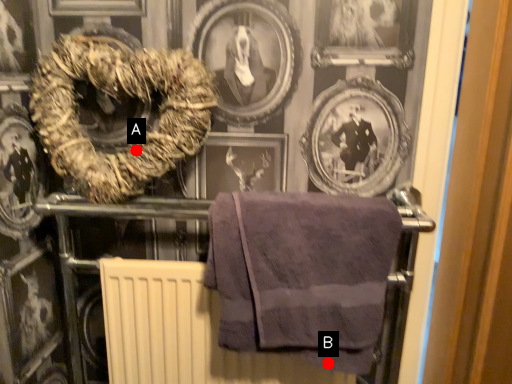
Question: Two points are circled on the image, labeled by A and B beside each circle. Which point is closer to the camera taking this photo?

Choices:
 (A) A is closer
 (B) B is closer

Answer: (B)